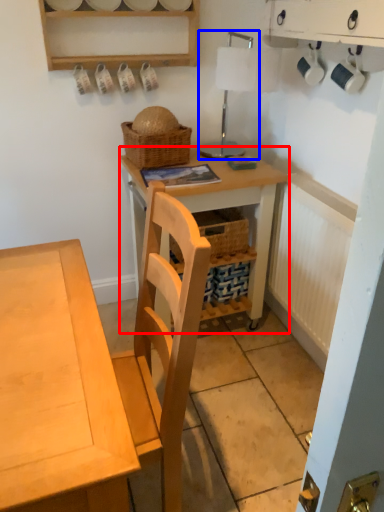
Question: Which object appears closest to the camera in this image, table (highlighted by a red box) or table lamp (highlighted by a blue box)?

Choices:
 (A) table
 (B) table lamp

Answer: (B)